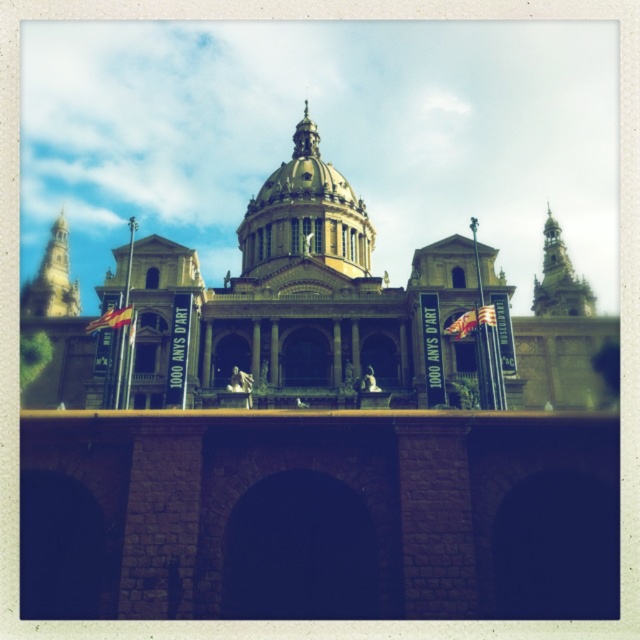
Question: Is gold textured dome at center below gold stone tower at upper right?

Choices:
 (A) no
 (B) yes

Answer: (A)

Question: Can you confirm if gold textured dome at center is positioned to the right of golden stone tower at upper left?

Choices:
 (A) no
 (B) yes

Answer: (B)

Question: Which point is closer to the camera taking this photo?

Choices:
 (A) (60, 294)
 (B) (547, 221)

Answer: (A)

Question: Based on their relative distances, which object is farther from the golden stone tower at upper left?

Choices:
 (A) gold stone tower at upper right
 (B) gold textured dome at center

Answer: (A)

Question: Can you confirm if gold stone tower at upper right is wider than golden stone tower at upper left?

Choices:
 (A) no
 (B) yes

Answer: (A)

Question: Estimate the real-world distances between objects in this image. Which object is closer to the gold textured dome at center?

Choices:
 (A) golden stone tower at upper left
 (B) gold stone tower at upper right

Answer: (A)